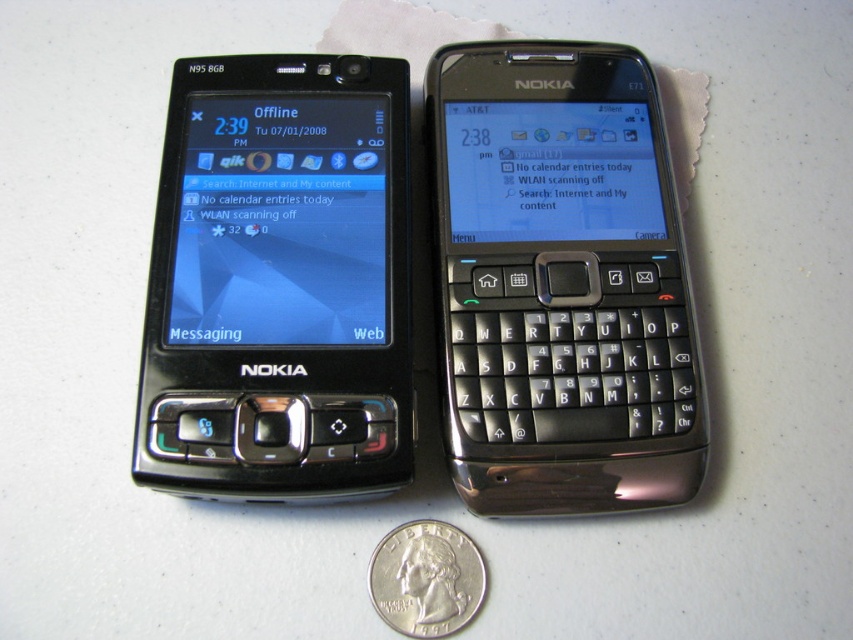
Between satin black phone at center and matte black phone at left, which one appears on the left side from the viewer's perspective?

matte black phone at left

Is point (576, 243) positioned after point (238, 333)?

Yes, point (576, 243) is farther from viewer.

This screenshot has height=640, width=853. Find the location of `satin black phone at center`. satin black phone at center is located at coordinates (561, 282).

Between point (553, 440) and point (479, 563), which one is positioned behind?

Positioned behind is point (553, 440).

Which is behind, point (659, 148) or point (428, 525)?

The point (659, 148) is behind.

At what (x,y) coordinates should I click in order to perform the action: click on satin black phone at center. Please return your answer as a coordinate pair (x, y). Looking at the image, I should click on (561, 282).

Which of these two, matte black phone at left or silver metallic quarter at lower center, stands shorter?

silver metallic quarter at lower center is shorter.

Consider the image. Is matte black phone at left positioned behind silver metallic quarter at lower center?

No, it is in front of silver metallic quarter at lower center.

This screenshot has height=640, width=853. What are the coordinates of `matte black phone at left` in the screenshot? It's located at (279, 282).

Find the location of a particular element. matte black phone at left is located at coordinates (279, 282).